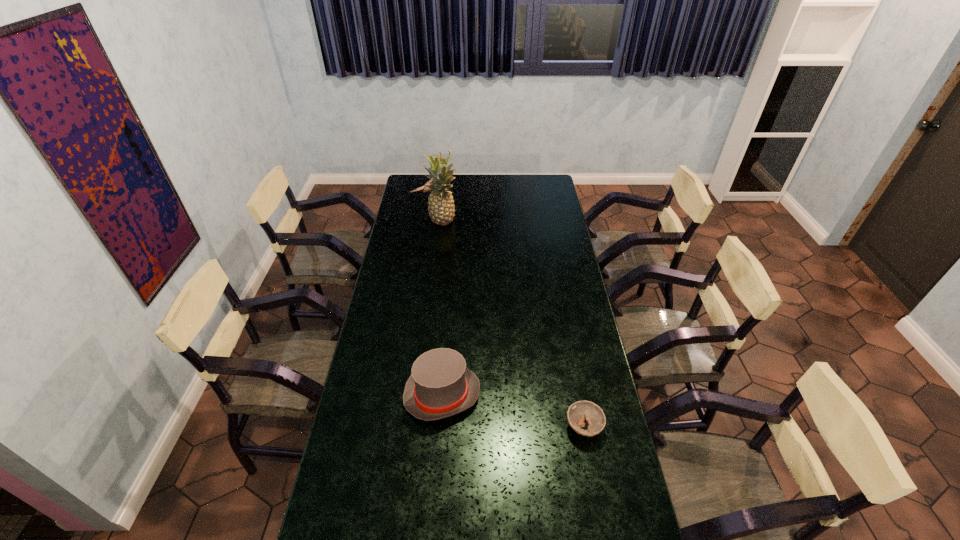
This screenshot has height=540, width=960. In order to click on the third nearest object in this screenshot , I will do `click(441, 208)`.

You are a GUI agent. You are given a task and a screenshot of the screen. Output one action in this format:
    pyautogui.click(x=<x>, y=<y>)
    Task: Click on the tallest object
    Image resolution: width=960 pixels, height=540 pixels.
    Given the screenshot: What is the action you would take?
    pyautogui.click(x=441, y=208)

The image size is (960, 540). What are the coordinates of `dress hat` in the screenshot? It's located at (440, 386).

Locate an element on the screen. This screenshot has width=960, height=540. the farthest object is located at coordinates (426, 189).

The height and width of the screenshot is (540, 960). Identify the location of the shortest object. (579, 411).

The width and height of the screenshot is (960, 540). In order to click on the rightmost object in this screenshot , I will do `click(579, 411)`.

The height and width of the screenshot is (540, 960). What are the coordinates of `vacant area situated on the right of the second farthest object` in the screenshot? It's located at (489, 222).

Where is `free space located 0.330m on the back of the dress hat`? free space located 0.330m on the back of the dress hat is located at coordinates (449, 302).

Find the location of a particular element. vacant space located at the face of the bird is located at coordinates pyautogui.click(x=501, y=194).

You are a GUI agent. You are given a task and a screenshot of the screen. Output one action in this format:
    pyautogui.click(x=<x>, y=<y>)
    Task: Click on the vacant area located 0.160m on the back of the bowl
    This screenshot has width=960, height=540.
    Given the screenshot: What is the action you would take?
    pyautogui.click(x=573, y=371)